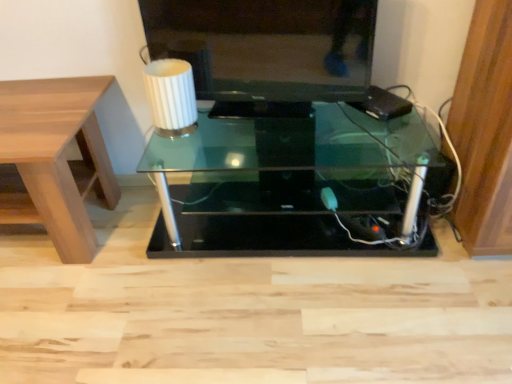
Where is `white ribbed glass at upper center`? The width and height of the screenshot is (512, 384). white ribbed glass at upper center is located at coordinates (170, 96).

Where is `matte black television at upper center`? Image resolution: width=512 pixels, height=384 pixels. matte black television at upper center is located at coordinates (268, 46).

This screenshot has height=384, width=512. Describe the element at coordinates (268, 46) in the screenshot. I see `matte black television at upper center` at that location.

Describe the element at coordinates (56, 159) in the screenshot. I see `light brown wood table at left, the second table viewed from the right` at that location.

Describe the element at coordinates (292, 186) in the screenshot. I see `transparent glass table at center, which is the 1th table in right-to-left order` at that location.

The image size is (512, 384). Find the location of `white ribbed glass at upper center`. white ribbed glass at upper center is located at coordinates (170, 96).

Considering the relative sizes of white ribbed glass at upper center and matte black television at upper center in the image provided, is white ribbed glass at upper center shorter than matte black television at upper center?

Yes, white ribbed glass at upper center is shorter than matte black television at upper center.

Between white ribbed glass at upper center and matte black television at upper center, which one has larger size?

matte black television at upper center is bigger.

Is white ribbed glass at upper center facing towards matte black television at upper center?

No, white ribbed glass at upper center is not facing towards matte black television at upper center.

Looking at this image, from a real-world perspective, which is physically above, white ribbed glass at upper center or matte black television at upper center?

From a 3D spatial view, matte black television at upper center is above.

Is transparent glass table at center, which is the 1th table in right-to-left order, far away from matte black television at upper center?

No, transparent glass table at center, which is the 1th table in right-to-left order, is not far from matte black television at upper center.

Would you say transparent glass table at center, which is the 1th table in right-to-left order, contains matte black television at upper center?

No, matte black television at upper center is not inside transparent glass table at center, which is the 1th table in right-to-left order.

Is transparent glass table at center, which is counted as the second table, starting from the left, oriented towards matte black television at upper center?

No.

How different are the orientations of transparent glass table at center, which is counted as the second table, starting from the left, and matte black television at upper center in degrees?

The angle between the facing direction of transparent glass table at center, which is counted as the second table, starting from the left, and the facing direction of matte black television at upper center is 9.82 degrees.

From the picture: What's the angular difference between light brown wood table at left, the 1th table viewed from the left, and white ribbed glass at upper center's facing directions?

They differ by 5.5 degrees in their facing directions.

From a real-world perspective, is light brown wood table at left, the second table viewed from the right, located higher than white ribbed glass at upper center?

No, from a real-world perspective, light brown wood table at left, the second table viewed from the right, is not on top of white ribbed glass at upper center.

Is light brown wood table at left, the second table viewed from the right, beside white ribbed glass at upper center?

No, light brown wood table at left, the second table viewed from the right, is not in contact with white ribbed glass at upper center.

Is point (93, 183) behind point (189, 105)?

Yes, it is behind point (189, 105).

Looking at this image, is transparent glass table at center, which is the 1th table in right-to-left order, far away from light brown wood table at left, the 1th table viewed from the left?

That's not correct — transparent glass table at center, which is the 1th table in right-to-left order, is a little close to light brown wood table at left, the 1th table viewed from the left.

Can you confirm if transparent glass table at center, which is counted as the second table, starting from the left, is positioned to the right of light brown wood table at left, the second table viewed from the right?

Indeed, transparent glass table at center, which is counted as the second table, starting from the left, is positioned on the right side of light brown wood table at left, the second table viewed from the right.

Is point (193, 183) farther from viewer compared to point (77, 227)?

Yes, it is behind point (77, 227).

How different are the orientations of transparent glass table at center, which is counted as the second table, starting from the left, and light brown wood table at left, the 1th table viewed from the left, in degrees?

They differ by 0.31 degrees in their facing directions.

Measure the distance between matte black television at upper center and white ribbed glass at upper center.

A distance of 23.55 centimeters exists between matte black television at upper center and white ribbed glass at upper center.

From a real-world perspective, does matte black television at upper center stand above white ribbed glass at upper center?

Yes, from a real-world perspective, matte black television at upper center is over white ribbed glass at upper center

From the image's perspective, is matte black television at upper center positioned above or below white ribbed glass at upper center?

From the image's perspective, matte black television at upper center appears above white ribbed glass at upper center.

In the scene shown: From the image's perspective, is white ribbed glass at upper center above or below transparent glass table at center, which is the 1th table in right-to-left order?

Based on their image positions, white ribbed glass at upper center is located above transparent glass table at center, which is the 1th table in right-to-left order.

Between white ribbed glass at upper center and transparent glass table at center, which is the 1th table in right-to-left order, which one appears on the right side from the viewer's perspective?

transparent glass table at center, which is the 1th table in right-to-left order, is more to the right.

Measure the distance from white ribbed glass at upper center to transparent glass table at center, which is the 1th table in right-to-left order.

white ribbed glass at upper center and transparent glass table at center, which is the 1th table in right-to-left order, are 45.91 centimeters apart from each other.

Who is taller, white ribbed glass at upper center or transparent glass table at center, which is counted as the second table, starting from the left?

transparent glass table at center, which is counted as the second table, starting from the left, is taller.

Would you say light brown wood table at left, the second table viewed from the right, contains transparent glass table at center, which is the 1th table in right-to-left order?

Actually, transparent glass table at center, which is the 1th table in right-to-left order, is outside light brown wood table at left, the second table viewed from the right.

From a real-world perspective, relative to transparent glass table at center, which is counted as the second table, starting from the left, is light brown wood table at left, the 1th table viewed from the left, vertically above or below?

light brown wood table at left, the 1th table viewed from the left, is above transparent glass table at center, which is counted as the second table, starting from the left.

Between light brown wood table at left, the 1th table viewed from the left, and transparent glass table at center, which is counted as the second table, starting from the left, which one has more height?

light brown wood table at left, the 1th table viewed from the left.

Locate an element on the screen. The image size is (512, 384). television on the right side of white ribbed glass at upper center is located at coordinates (268, 46).

Where is `television located on the left of transparent glass table at center, which is counted as the second table, starting from the left`? The image size is (512, 384). television located on the left of transparent glass table at center, which is counted as the second table, starting from the left is located at coordinates (268, 46).

Looking at the image, which one is located further to white ribbed glass at upper center, transparent glass table at center, which is the 1th table in right-to-left order, or matte black television at upper center?

transparent glass table at center, which is the 1th table in right-to-left order, is further to white ribbed glass at upper center.

Estimate the real-world distances between objects in this image. Which object is further from light brown wood table at left, the 1th table viewed from the left, white ribbed glass at upper center or transparent glass table at center, which is the 1th table in right-to-left order?

transparent glass table at center, which is the 1th table in right-to-left order, is further to light brown wood table at left, the 1th table viewed from the left.

When comparing their distances from matte black television at upper center, does white ribbed glass at upper center or light brown wood table at left, the second table viewed from the right, seem closer?

Among the two, white ribbed glass at upper center is located nearer to matte black television at upper center.

Considering their positions, is light brown wood table at left, the 1th table viewed from the left, positioned closer to white ribbed glass at upper center than transparent glass table at center, which is counted as the second table, starting from the left?

light brown wood table at left, the 1th table viewed from the left, is positioned closer to the anchor white ribbed glass at upper center.

Estimate the real-world distances between objects in this image. Which object is further from transparent glass table at center, which is counted as the second table, starting from the left, matte black television at upper center or white ribbed glass at upper center?

Among the two, white ribbed glass at upper center is located further to transparent glass table at center, which is counted as the second table, starting from the left.

Estimate the real-world distances between objects in this image. Which object is further from matte black television at upper center, light brown wood table at left, the 1th table viewed from the left, or transparent glass table at center, which is the 1th table in right-to-left order?

The object further to matte black television at upper center is light brown wood table at left, the 1th table viewed from the left.

Based on their spatial positions, is light brown wood table at left, the second table viewed from the right, or matte black television at upper center further from transparent glass table at center, which is counted as the second table, starting from the left?

light brown wood table at left, the second table viewed from the right, is positioned further to the anchor transparent glass table at center, which is counted as the second table, starting from the left.

From the image, which object appears to be farther from light brown wood table at left, the 1th table viewed from the left, transparent glass table at center, which is the 1th table in right-to-left order, or matte black television at upper center?

Among the two, transparent glass table at center, which is the 1th table in right-to-left order, is located further to light brown wood table at left, the 1th table viewed from the left.

Locate an element on the screen. This screenshot has width=512, height=384. table lamp located between light brown wood table at left, the 1th table viewed from the left, and transparent glass table at center, which is the 1th table in right-to-left order, in the left-right direction is located at coordinates (170, 96).

What are the coordinates of `television situated between white ribbed glass at upper center and transparent glass table at center, which is the 1th table in right-to-left order, from left to right` in the screenshot? It's located at (268, 46).

Where is `table lamp located between light brown wood table at left, the second table viewed from the right, and matte black television at upper center in the left-right direction`? table lamp located between light brown wood table at left, the second table viewed from the right, and matte black television at upper center in the left-right direction is located at coordinates (170, 96).

Identify the location of television between light brown wood table at left, the second table viewed from the right, and transparent glass table at center, which is counted as the second table, starting from the left, in the horizontal direction. (268, 46).